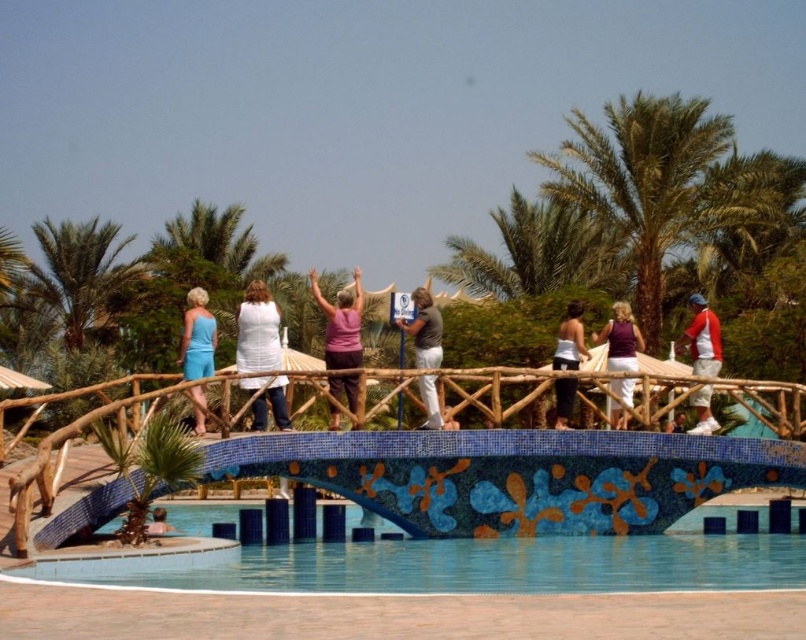
How far apart are green leafy palm tree at upper center and matte gray shirt at center?

84.74 meters

Is green leafy palm tree at upper center behind matte gray shirt at center?

Yes.

Where is `green leafy palm tree at upper center`? green leafy palm tree at upper center is located at coordinates (536, 252).

Is blue mosaic water at lower center taller than green leafy palm tree at upper right?

No, blue mosaic water at lower center is not taller than green leafy palm tree at upper right.

Is point (708, 548) farther from viewer compared to point (642, 237)?

No.

At what (x,y) coordinates should I click in order to perform the action: click on blue mosaic water at lower center. Please return your answer as a coordinate pair (x, y). Image resolution: width=806 pixels, height=640 pixels. Looking at the image, I should click on (489, 563).

Is white cotton shirt at center to the left of matte gray shirt at center from the viewer's perspective?

Correct, you'll find white cotton shirt at center to the left of matte gray shirt at center.

Is white cotton shirt at center below matte gray shirt at center?

No, white cotton shirt at center is not below matte gray shirt at center.

Identify the location of white cotton shirt at center. Image resolution: width=806 pixels, height=640 pixels. (256, 330).